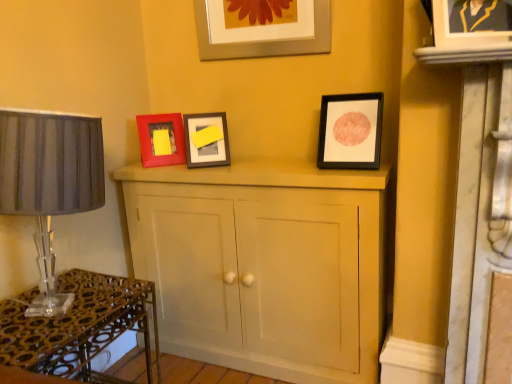
The height and width of the screenshot is (384, 512). Describe the element at coordinates (262, 28) in the screenshot. I see `metallic silver picture frame at upper center, placed as the 3th picture frame when sorted from right to left` at that location.

The image size is (512, 384). What do you see at coordinates (50, 182) in the screenshot?
I see `matte gray lampshade at left` at bounding box center [50, 182].

The image size is (512, 384). I want to click on matte red picture frame at center left, which is the 4th picture frame from right to left, so click(x=161, y=139).

Locate an element on the screen. The height and width of the screenshot is (384, 512). metallic silver picture frame at upper center, the second picture frame from the back is located at coordinates (262, 28).

Could you tell me if metallic silver picture frame at upper center, which is the 3th picture frame from front to back, is facing matte black picture frame at upper right, which ranks as the 2th picture frame in front-to-back order?

No, metallic silver picture frame at upper center, which is the 3th picture frame from front to back, is not facing towards matte black picture frame at upper right, which ranks as the 2th picture frame in front-to-back order.

Which of these two, metallic silver picture frame at upper center, the second picture frame from the back, or matte black picture frame at upper right, arranged as the third picture frame when viewed from the back, stands shorter?

Standing shorter between the two is metallic silver picture frame at upper center, the second picture frame from the back.

From a real-world perspective, which object rests below the other?

From a 3D spatial view, matte black picture frame at upper right, which ranks as the 2th picture frame in front-to-back order, is below.

Considering their positions, is metallic silver picture frame at upper center, the second picture frame from the left, located in front of or behind matte black picture frame at upper right, which ranks as the 2th picture frame in front-to-back order?

Visually, metallic silver picture frame at upper center, the second picture frame from the left, is located behind matte black picture frame at upper right, which ranks as the 2th picture frame in front-to-back order.

From the picture: From a real-world perspective, is matte black picture frame at upper right, which ranks as the first picture frame in right-to-left order, above or below metallic glass table at lower left?

From a real-world perspective, matte black picture frame at upper right, which ranks as the first picture frame in right-to-left order, is physically above metallic glass table at lower left.

Considering the relative sizes of matte black picture frame at upper right, the fourth picture frame viewed from the left, and metallic glass table at lower left in the image provided, is matte black picture frame at upper right, the fourth picture frame viewed from the left, shorter than metallic glass table at lower left?

Indeed, matte black picture frame at upper right, the fourth picture frame viewed from the left, has a lesser height compared to metallic glass table at lower left.

Is matte black picture frame at upper right, the fourth picture frame viewed from the left, completely or partially outside of metallic glass table at lower left?

matte black picture frame at upper right, the fourth picture frame viewed from the left, is positioned outside metallic glass table at lower left.

The height and width of the screenshot is (384, 512). I want to click on table below the matte black picture frame at upper right, the fourth picture frame viewed from the left (from the image's perspective), so click(x=78, y=326).

This screenshot has height=384, width=512. In order to click on table lying below the metallic silver picture frame at upper center, which is the 3th picture frame from front to back (from the image's perspective) in this screenshot , I will do point(78,326).

Considering the relative sizes of metallic silver picture frame at upper center, the second picture frame from the back, and metallic glass table at lower left in the image provided, is metallic silver picture frame at upper center, the second picture frame from the back, bigger than metallic glass table at lower left?

Actually, metallic silver picture frame at upper center, the second picture frame from the back, might be smaller than metallic glass table at lower left.

Is metallic glass table at lower left inside metallic silver picture frame at upper center, placed as the 3th picture frame when sorted from right to left?

No, metallic glass table at lower left is not inside metallic silver picture frame at upper center, placed as the 3th picture frame when sorted from right to left.

Is matte gray lampshade at left to the right of matte black picture frame at upper right, positioned as the 1th picture frame in front-to-back order, from the viewer's perspective?

No, matte gray lampshade at left is not to the right of matte black picture frame at upper right, positioned as the 1th picture frame in front-to-back order.

What's the angular difference between matte gray lampshade at left and matte black picture frame at upper right, the fourth picture frame viewed from the left,'s facing directions?

They differ by 72.4 degrees in their facing directions.

Would you consider matte gray lampshade at left to be distant from matte black picture frame at upper right, positioned as the 1th picture frame in front-to-back order?

That's right, there is a large distance between matte gray lampshade at left and matte black picture frame at upper right, positioned as the 1th picture frame in front-to-back order.

Is matte gray lampshade at left located outside matte black picture frame at upper right, the fourth picture frame viewed from the left?

matte gray lampshade at left lies outside matte black picture frame at upper right, the fourth picture frame viewed from the left,'s area.

Is matte red picture frame at center left, which appears as the fourth picture frame when viewed from the front, placed right next to matte black picture frame at upper right, which is the second picture frame in right-to-left order?

No, matte red picture frame at center left, which appears as the fourth picture frame when viewed from the front, is not in contact with matte black picture frame at upper right, which is the second picture frame in right-to-left order.

Does matte red picture frame at center left, which appears as the fourth picture frame when viewed from the front, have a smaller size compared to matte black picture frame at upper right, which ranks as the 2th picture frame in front-to-back order?

No.

Does matte red picture frame at center left, which appears as the fourth picture frame when viewed from the front, come in front of matte black picture frame at upper right, the 3th picture frame positioned from the left?

No, it is not.

Are metallic glass table at lower left and metallic silver picture frame at upper center, which is the 3th picture frame from front to back, far apart?

Yes, metallic glass table at lower left and metallic silver picture frame at upper center, which is the 3th picture frame from front to back, are quite far apart.

Which object is closer to the camera, metallic glass table at lower left or metallic silver picture frame at upper center, which is the 3th picture frame from front to back?

metallic glass table at lower left is closer to the camera.

From a real-world perspective, is metallic glass table at lower left on top of metallic silver picture frame at upper center, which is the 3th picture frame from front to back?

No, from a real-world perspective, metallic glass table at lower left is not over metallic silver picture frame at upper center, which is the 3th picture frame from front to back

From a real-world perspective, is matte gray lampshade at left physically located above or below metallic glass table at lower left?

From a real-world perspective, matte gray lampshade at left is physically above metallic glass table at lower left.

In the scene shown: How far apart are matte gray lampshade at left and metallic glass table at lower left?

matte gray lampshade at left and metallic glass table at lower left are 19.01 inches apart from each other.

In the scene shown: Can you confirm if matte gray lampshade at left is taller than metallic glass table at lower left?

Correct, matte gray lampshade at left is much taller as metallic glass table at lower left.

Is the depth of matte gray lampshade at left greater than that of metallic glass table at lower left?

No, the depth of matte gray lampshade at left is less than that of metallic glass table at lower left.

Starting from the metallic silver picture frame at upper center, which is the 3th picture frame from front to back, which picture frame is the 1st one to the right? Please provide its 2D coordinates.

[(350, 131)]

This screenshot has width=512, height=384. Identify the location of the 1st picture frame behind the metallic glass table at lower left, counting from the anchor's position. (471, 22).

Estimate the real-world distances between objects in this image. Which object is closer to metallic silver picture frame at upper center, placed as the 3th picture frame when sorted from right to left, matte black picture frame at upper right, which ranks as the 2th picture frame in front-to-back order, or matte red picture frame at center left, which is the 4th picture frame from right to left?

Among the two, matte black picture frame at upper right, which ranks as the 2th picture frame in front-to-back order, is located nearer to metallic silver picture frame at upper center, placed as the 3th picture frame when sorted from right to left.

When comparing their distances from matte red picture frame at center left, which appears as the fourth picture frame when viewed from the front, does matte black picture frame at upper right, which is the second picture frame in right-to-left order, or metallic glass table at lower left seem further?

matte black picture frame at upper right, which is the second picture frame in right-to-left order, lies further to matte red picture frame at center left, which appears as the fourth picture frame when viewed from the front, than the other object.

Consider the image. Which object lies further to the anchor point matte wooden cupboard at center, metallic glass table at lower left or matte black picture frame at upper right, which ranks as the 2th picture frame in front-to-back order?

The object further to matte wooden cupboard at center is metallic glass table at lower left.

Looking at this image, when comparing their distances from matte red picture frame at center left, which is the 1th picture frame in left-to-right order, does matte black picture frame at upper right, which is the second picture frame in right-to-left order, or matte black picture frame at upper right, the fourth picture frame viewed from the left, seem further?

matte black picture frame at upper right, the fourth picture frame viewed from the left, lies further to matte red picture frame at center left, which is the 1th picture frame in left-to-right order, than the other object.

Based on their spatial positions, is matte wooden cupboard at center or matte gray lampshade at left further from matte black picture frame at upper right, the 3th picture frame positioned from the left?

matte gray lampshade at left is positioned further to the anchor matte black picture frame at upper right, the 3th picture frame positioned from the left.

Based on their spatial positions, is matte gray lampshade at left or metallic silver picture frame at upper center, the second picture frame from the back, further from matte black picture frame at upper right, which ranks as the 2th picture frame in front-to-back order?

The object further to matte black picture frame at upper right, which ranks as the 2th picture frame in front-to-back order, is matte gray lampshade at left.

When comparing their distances from matte black picture frame at upper right, which is the second picture frame in right-to-left order, does matte black picture frame at upper right, which ranks as the first picture frame in right-to-left order, or metallic silver picture frame at upper center, placed as the 3th picture frame when sorted from right to left, seem further?

Among the two, matte black picture frame at upper right, which ranks as the first picture frame in right-to-left order, is located further to matte black picture frame at upper right, which is the second picture frame in right-to-left order.

Looking at the image, which one is located further to matte black picture frame at upper right, arranged as the third picture frame when viewed from the back, metallic silver picture frame at upper center, which is the 3th picture frame from front to back, or matte wooden cupboard at center?

matte wooden cupboard at center.

Locate an element on the screen. This screenshot has width=512, height=384. cupboard between metallic glass table at lower left and matte black picture frame at upper right, which ranks as the first picture frame in right-to-left order, in the horizontal direction is located at coordinates (264, 265).

Identify the location of cupboard between matte red picture frame at center left, marked as the 1th picture frame in a back-to-front arrangement, and matte black picture frame at upper right, positioned as the 1th picture frame in front-to-back order, from left to right. The image size is (512, 384). (264, 265).

Locate an element on the screen. The height and width of the screenshot is (384, 512). table between matte gray lampshade at left and matte black picture frame at upper right, which is the second picture frame in right-to-left order, from left to right is located at coordinates (78, 326).

Where is `picture frame between matte black picture frame at upper right, which ranks as the first picture frame in right-to-left order, and metallic silver picture frame at upper center, the second picture frame from the back, along the z-axis`? picture frame between matte black picture frame at upper right, which ranks as the first picture frame in right-to-left order, and metallic silver picture frame at upper center, the second picture frame from the back, along the z-axis is located at coordinates (350, 131).